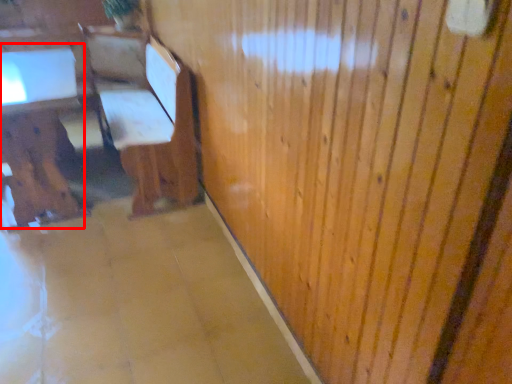
Question: From the image's perspective, what is the correct spatial relationship of table (annotated by the red box) in relation to furniture?

Choices:
 (A) above
 (B) below

Answer: (B)